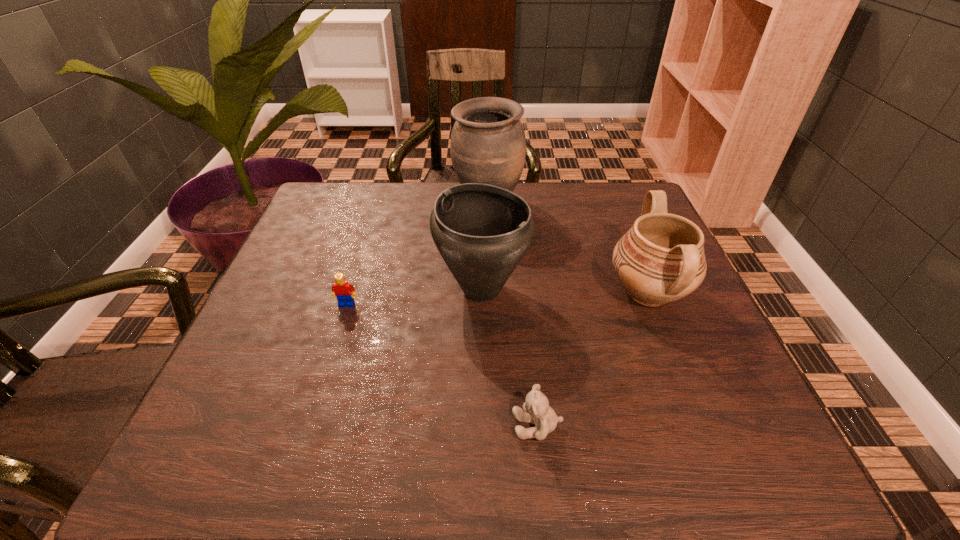
In order to click on the farthest urn in this screenshot , I will do `click(488, 145)`.

The height and width of the screenshot is (540, 960). Find the location of `the tallest object`. the tallest object is located at coordinates (488, 145).

You are a GUI agent. You are given a task and a screenshot of the screen. Output one action in this format:
    pyautogui.click(x=<x>, y=<y>)
    Task: Click on the rightmost object
    The image size is (960, 540).
    Given the screenshot: What is the action you would take?
    pyautogui.click(x=661, y=259)

You are a GUI agent. You are given a task and a screenshot of the screen. Output one action in this format:
    pyautogui.click(x=<x>, y=<y>)
    Task: Click on the leftmost object
    This screenshot has width=960, height=540.
    Given the screenshot: What is the action you would take?
    pyautogui.click(x=341, y=289)

This screenshot has width=960, height=540. What are the coordinates of `teddy bear` in the screenshot? It's located at (537, 411).

You are a GUI agent. You are given a task and a screenshot of the screen. Output one action in this format:
    pyautogui.click(x=<x>, y=<y>)
    Task: Click on the free space located 0.190m on the left of the tallest urn
    The width and height of the screenshot is (960, 540).
    Given the screenshot: What is the action you would take?
    pyautogui.click(x=384, y=204)

Find the location of a particular element. The image size is (960, 540). vacant space located 0.200m on the front-facing side of the rightmost object is located at coordinates (514, 292).

The height and width of the screenshot is (540, 960). I want to click on vacant space located on the front-facing side of the rightmost object, so click(x=523, y=292).

Identify the location of vacant region located on the front-facing side of the rightmost object. (459, 292).

Find the location of `vacant space positioned on the front-facing side of the leftmost object`. vacant space positioned on the front-facing side of the leftmost object is located at coordinates (317, 400).